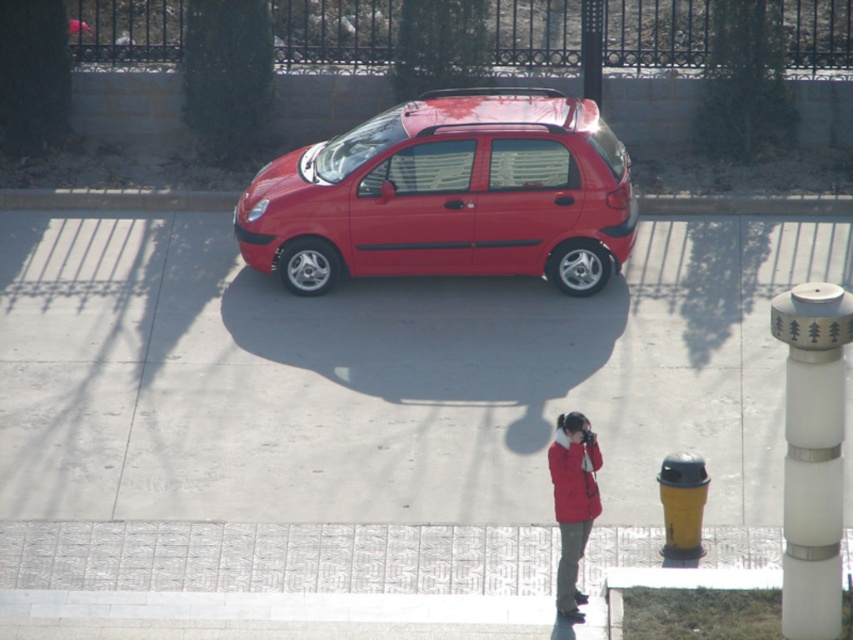
Is smooth concrete curb at center below red matte jacket at lower center?

No.

Which of these two, smooth concrete curb at center or red matte jacket at lower center, stands taller?

red matte jacket at lower center is taller.

Where is `smooth concrete curb at center`? This screenshot has width=853, height=640. smooth concrete curb at center is located at coordinates (115, 198).

Does smooth concrete pavement at center have a larger size compared to red matte jacket at lower center?

Incorrect, smooth concrete pavement at center is not larger than red matte jacket at lower center.

Who is more distant from viewer, (310, 378) or (567, 611)?

Positioned behind is point (310, 378).

Locate an element on the screen. This screenshot has width=853, height=640. smooth concrete pavement at center is located at coordinates (383, 376).

Locate an element on the screen. Image resolution: width=853 pixels, height=640 pixels. smooth concrete pavement at center is located at coordinates (383, 376).

Is smooth concrete pavement at center below smooth concrete curb at center?

Indeed, smooth concrete pavement at center is positioned under smooth concrete curb at center.

This screenshot has width=853, height=640. I want to click on smooth concrete pavement at center, so (x=383, y=376).